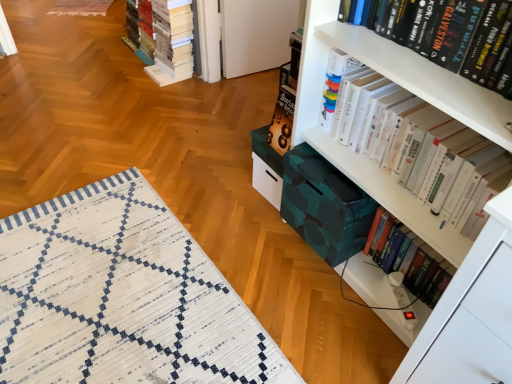
Question: From the image's perspective, relative to hardcover book at lower right, placed as the second book when sorted from back to front, is white paper book at upper left, the 4th book when ordered from front to back, above or below?

Choices:
 (A) below
 (B) above

Answer: (B)

Question: Looking at their shapes, would you say white paper book at upper left, the 4th book when ordered from front to back, is wider or thinner than hardcover book at lower right, acting as the 1th book starting from the right?

Choices:
 (A) thin
 (B) wide

Answer: (B)

Question: Estimate the real-world distances between objects in this image. Which object is closer to the rustic woolen quilt at upper left?

Choices:
 (A) hardcover book at upper right, the third book from the right
 (B) white woven mat at lower left
 (C) white glossy book at upper right, which is counted as the second book, starting from the front
 (D) white paper book at upper left, placed as the 1th book when sorted from back to front
 (E) hardcover book at lower right, acting as the 1th book starting from the right

Answer: (D)

Question: Which object is the closest to the white paper book at upper left, which is counted as the 4th book, starting from the right?

Choices:
 (A) white woven mat at lower left
 (B) hardcover book at lower right, acting as the 1th book starting from the right
 (C) hardcover book at upper right, the third book from the right
 (D) rustic woolen quilt at upper left
 (E) white glossy book at upper right, the 2th book viewed from the right

Answer: (D)